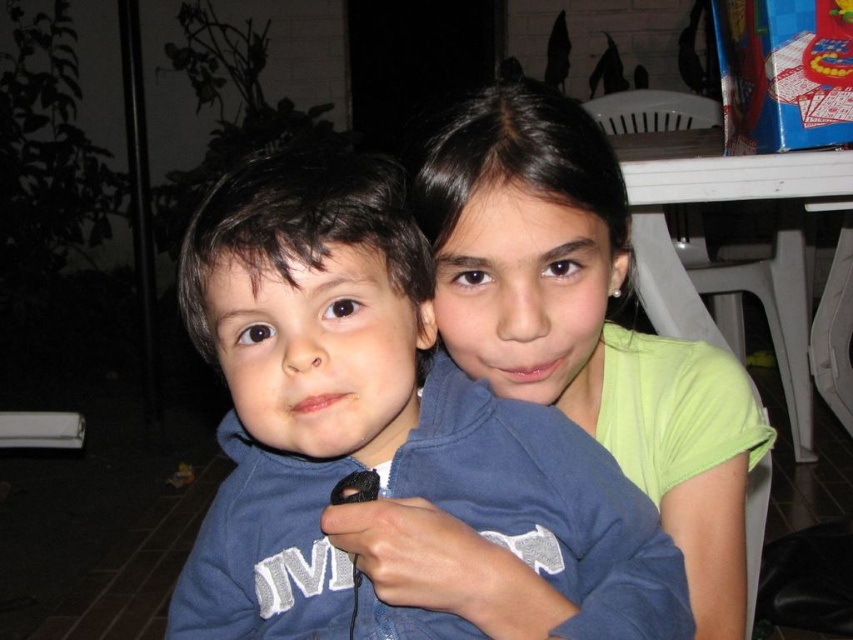
You are a photographer who wants to adjust the lighting for a photo of the blue fleece jacket at center. The camera is set to focus on the point at coordinates (376, 419). Where should you direct the main light source to ensure the jacket is well lit?

The blue fleece jacket at center is located at point (376, 419), so the main light source should be directed towards that coordinate to ensure proper lighting on the jacket.

You are a photographer standing at a certain distance from the blue fleece jacket at center. You want to take a photo where the jacket fills the frame perfectly. If your camera has a minimum focusing distance of 50 centimeters, will you need to move closer or farther away?

The blue fleece jacket at center is currently 46.21 centimeters away from the camera, which is closer than the camera minimum focusing distance of 50 centimeters. Therefore, you need to move farther away to ensure the camera can focus properly.

You are a photographer trying to capture a closeup of the blue fleece jacket at center and the light green fabric shirt at upper right. Which object should you zoom in on first to ensure both are in focus?

The blue fleece jacket at center is smaller than the light green fabric shirt at upper right, so you should zoom in on the light green fabric shirt at upper right first to ensure both are in focus.